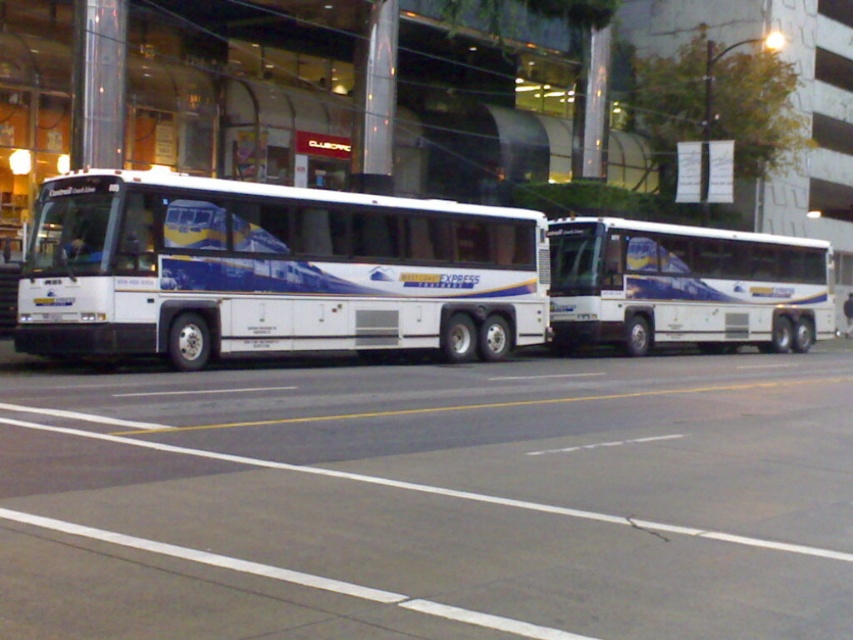
Which is in front, point (763, 294) or point (843, 312)?

Point (763, 294) is in front.

Is white glossy bus at center shorter than dark blue fabric couple at center?

No, white glossy bus at center is not shorter than dark blue fabric couple at center.

Is point (828, 257) farther from camera compared to point (848, 314)?

That is False.

Locate an element on the screen. white glossy bus at center is located at coordinates (685, 285).

Does white glossy bus at left have a smaller size compared to white glossy bus at center?

Yes.

Can you confirm if white glossy bus at left is positioned to the right of white glossy bus at center?

Incorrect, white glossy bus at left is not on the right side of white glossy bus at center.

Between point (236, 282) and point (552, 292), which one is positioned behind?

Point (552, 292)

What are the coordinates of `white glossy bus at left` in the screenshot? It's located at (271, 269).

Between white glossy bus at left and dark blue fabric couple at center, which one has less height?

Standing shorter between the two is dark blue fabric couple at center.

Can you confirm if white glossy bus at left is taller than dark blue fabric couple at center?

Indeed, white glossy bus at left has a greater height compared to dark blue fabric couple at center.

Who is more forward, (209, 304) or (842, 310)?

Point (209, 304)

Locate an element on the screen. This screenshot has height=640, width=853. white glossy bus at left is located at coordinates (271, 269).